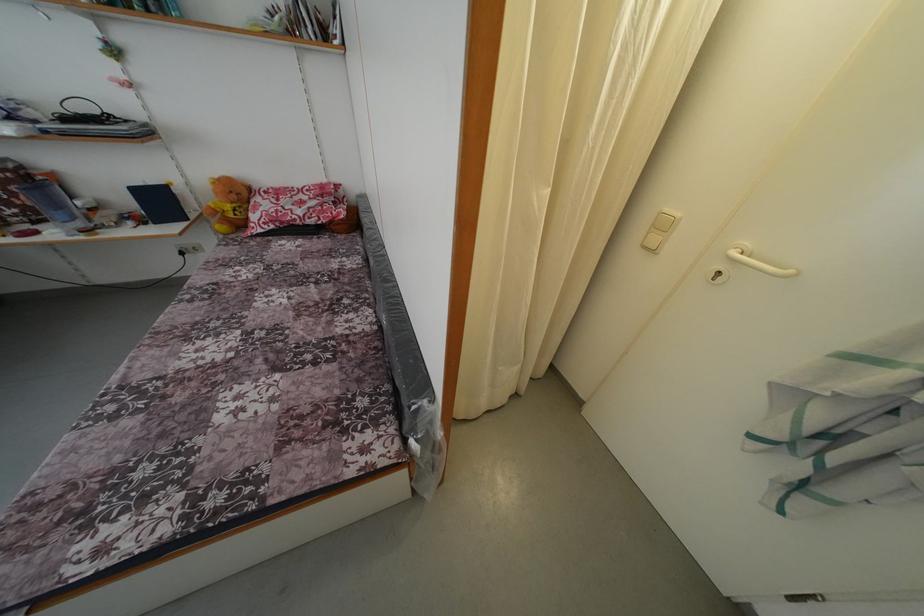
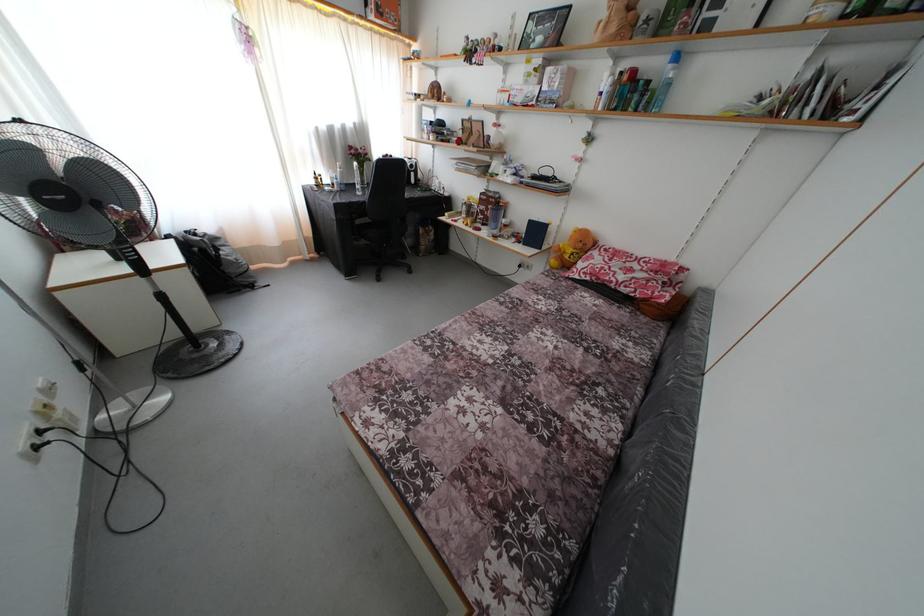
Question: How did the camera likely rotate?

Choices:
 (A) Left
 (B) Right
 (C) Up
 (D) Down

Answer: (A)